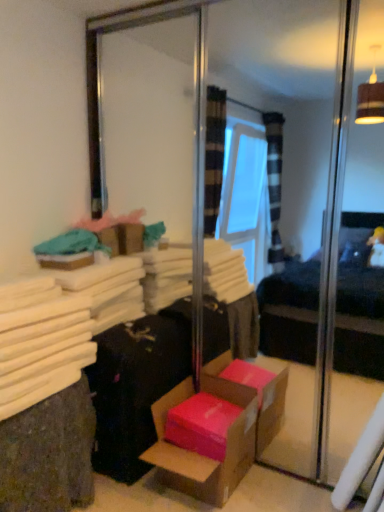
This screenshot has height=512, width=384. Find the location of `white fabric at left`. white fabric at left is located at coordinates [49, 454].

Describe the element at coordinates (196, 448) in the screenshot. The width and height of the screenshot is (384, 512). I see `pink cardboard box at lower center` at that location.

The image size is (384, 512). Find the location of `white fabric at left`. white fabric at left is located at coordinates (49, 454).

From the image's perspective, is pink cardboard box at lower center above or below white fabric at left?

pink cardboard box at lower center is situated lower than white fabric at left in the image.

Is point (211, 504) positioned behind point (39, 446)?

Yes, it is behind point (39, 446).

Is pink cardboard box at lower center closer to camera compared to white fabric at left?

No, pink cardboard box at lower center is behind white fabric at left.

Measure the distance between pink cardboard box at lower center and black fabric suitcase at lower left.

pink cardboard box at lower center is 9.27 inches away from black fabric suitcase at lower left.

In terms of width, does pink cardboard box at lower center look wider or thinner when compared to black fabric suitcase at lower left?

Clearly, pink cardboard box at lower center has more width compared to black fabric suitcase at lower left.

From a real-world perspective, is pink cardboard box at lower center physically above black fabric suitcase at lower left?

Actually, pink cardboard box at lower center is physically below black fabric suitcase at lower left in the real world.

Looking at this image, could you tell me if pink cardboard box at lower center is facing black fabric suitcase at lower left?

No, pink cardboard box at lower center is not turned towards black fabric suitcase at lower left.

Could you tell me if black fabric suitcase at lower left is facing white fabric at left?

No, black fabric suitcase at lower left is not oriented towards white fabric at left.

Does black fabric suitcase at lower left have a larger size compared to white fabric at left?

No, black fabric suitcase at lower left is not bigger than white fabric at left.

Considering the positions of objects black fabric suitcase at lower left and white fabric at left in the image provided, who is behind, black fabric suitcase at lower left or white fabric at left?

black fabric suitcase at lower left is behind.

Which object is thinner, black fabric suitcase at lower left or white fabric at left?

black fabric suitcase at lower left is thinner.

Could you tell me if black fabric suitcase at lower left is turned towards pink cardboard box at lower center?

Yes, black fabric suitcase at lower left faces towards pink cardboard box at lower center.

From a real-world perspective, is black fabric suitcase at lower left physically above pink cardboard box at lower center?

Yes.

Find the location of `luggage above the pink cardboard box at lower center (from the image's perspective)`. luggage above the pink cardboard box at lower center (from the image's perspective) is located at coordinates (134, 388).

Which is more to the right, white fabric at left or pink cardboard box at lower center?

Positioned to the right is pink cardboard box at lower center.

Is white fabric at left not within pink cardboard box at lower center?

Yes, white fabric at left is located beyond the bounds of pink cardboard box at lower center.

Which of these two, white fabric at left or pink cardboard box at lower center, is smaller?

pink cardboard box at lower center is smaller.

How far apart are white fabric at left and pink cardboard box at lower center?

white fabric at left and pink cardboard box at lower center are 51.14 centimeters apart from each other.

Is white fabric at left looking in the opposite direction of black fabric suitcase at lower left?

No, white fabric at left is not facing away from black fabric suitcase at lower left.

Is white fabric at left placed right next to black fabric suitcase at lower left?

No, white fabric at left is not making contact with black fabric suitcase at lower left.

Which object is closer to the camera, white fabric at left or black fabric suitcase at lower left?

white fabric at left.

Locate an element on the screen. shelf above the pink cardboard box at lower center (from the image's perspective) is located at coordinates (49, 454).

Identify the location of box on the right of the black fabric suitcase at lower left. The height and width of the screenshot is (512, 384). (196, 448).

Which object lies further to the anchor point white fabric at left, pink cardboard box at lower center or black fabric suitcase at lower left?

pink cardboard box at lower center is further to white fabric at left.

When comparing their distances from white fabric at left, does black fabric suitcase at lower left or pink cardboard box at lower center seem further?

pink cardboard box at lower center lies further to white fabric at left than the other object.

From the image, which object appears to be farther from pink cardboard box at lower center, white fabric at left or black fabric suitcase at lower left?

The object further to pink cardboard box at lower center is white fabric at left.

Looking at the image, which one is located further to pink cardboard box at lower center, black fabric suitcase at lower left or white fabric at left?

Based on the image, white fabric at left appears to be further to pink cardboard box at lower center.

Looking at this image, looking at the image, which one is located further to black fabric suitcase at lower left, white fabric at left or pink cardboard box at lower center?

white fabric at left lies further to black fabric suitcase at lower left than the other object.

Considering their positions, is pink cardboard box at lower center positioned further to black fabric suitcase at lower left than white fabric at left?

white fabric at left.

Where is `luggage between white fabric at left and pink cardboard box at lower center in the horizontal direction`? The image size is (384, 512). luggage between white fabric at left and pink cardboard box at lower center in the horizontal direction is located at coordinates (134, 388).